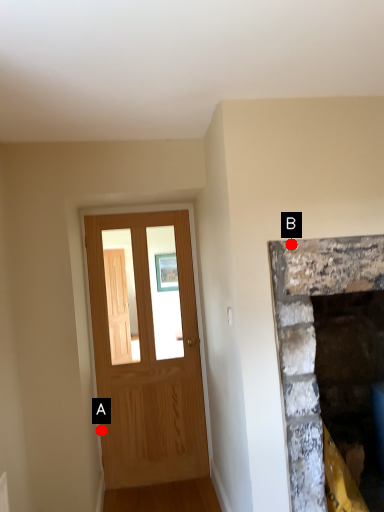
Question: Two points are circled on the image, labeled by A and B beside each circle. Which point appears farthest from the camera in this image?

Choices:
 (A) A is further
 (B) B is further

Answer: (A)